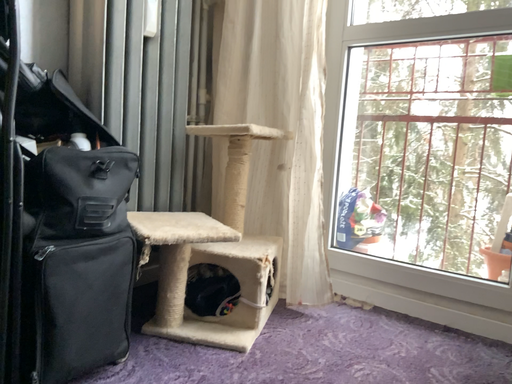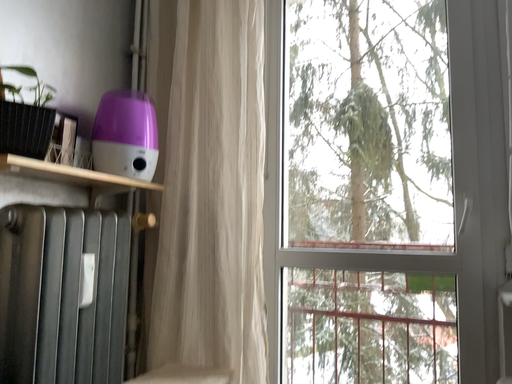
Question: Which way did the camera rotate in the video?

Choices:
 (A) rotated downward
 (B) rotated upward

Answer: (B)